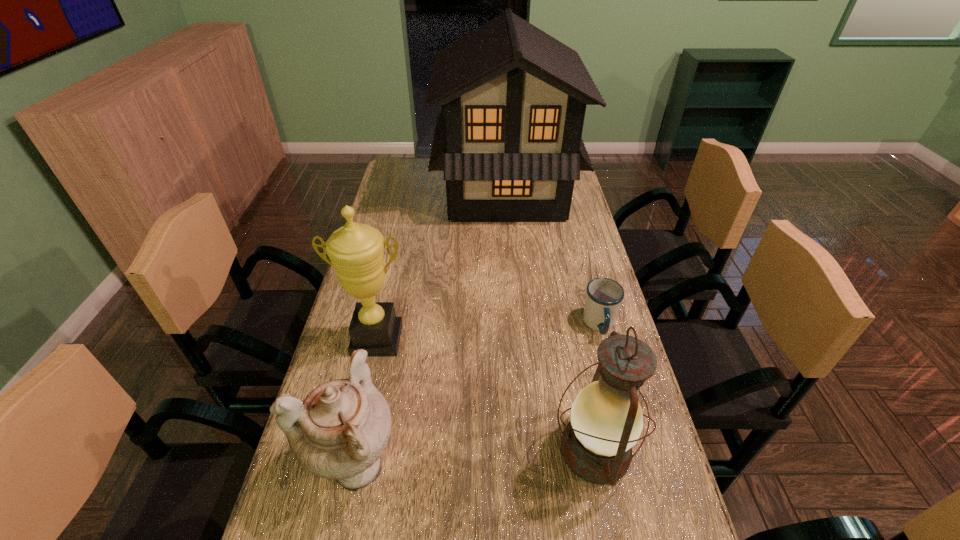
Identify the location of free space located 0.230m on the back of the oil lamp. (570, 331).

You are a GUI agent. You are given a task and a screenshot of the screen. Output one action in this format:
    pyautogui.click(x=<x>, y=<y>)
    Task: Click on the vacant space situated on the back of the fourth tallest object
    
    Given the screenshot: What is the action you would take?
    pyautogui.click(x=380, y=352)

This screenshot has height=540, width=960. I want to click on free space located 0.390m on the handle side of the shortest object, so click(x=645, y=497).

Identify the location of object that is at the far edge. The height and width of the screenshot is (540, 960). (509, 138).

What are the coordinates of `trophy cup at the left edge` in the screenshot? It's located at (356, 251).

The width and height of the screenshot is (960, 540). Find the location of `urn present at the left edge`. urn present at the left edge is located at coordinates (339, 432).

I want to click on dollhouse that is positioned at the right edge, so click(509, 138).

At what (x,y) coordinates should I click in order to perform the action: click on oil lamp positioned at the right edge. Please return your answer as a coordinate pair (x, y). Looking at the image, I should click on (606, 421).

This screenshot has height=540, width=960. Find the location of `mug present at the right edge`. mug present at the right edge is located at coordinates (604, 296).

I want to click on object that is positioned at the far right corner, so click(509, 138).